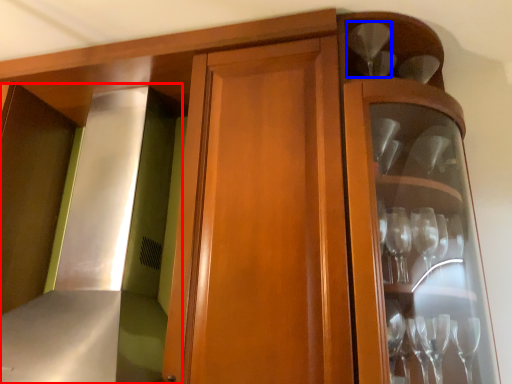
Question: Which object appears closest to the camera in this image, exhaust hood (highlighted by a red box) or wine glass (highlighted by a blue box)?

Choices:
 (A) exhaust hood
 (B) wine glass

Answer: (A)